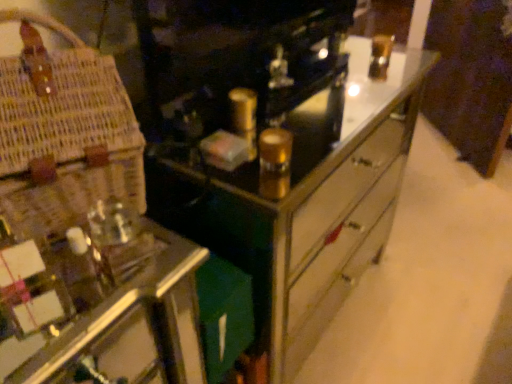
Locate an element on the screen. This screenshot has height=384, width=512. free point above metallic mirrored chest of drawers at center (from a real-world perspective) is located at coordinates (309, 94).